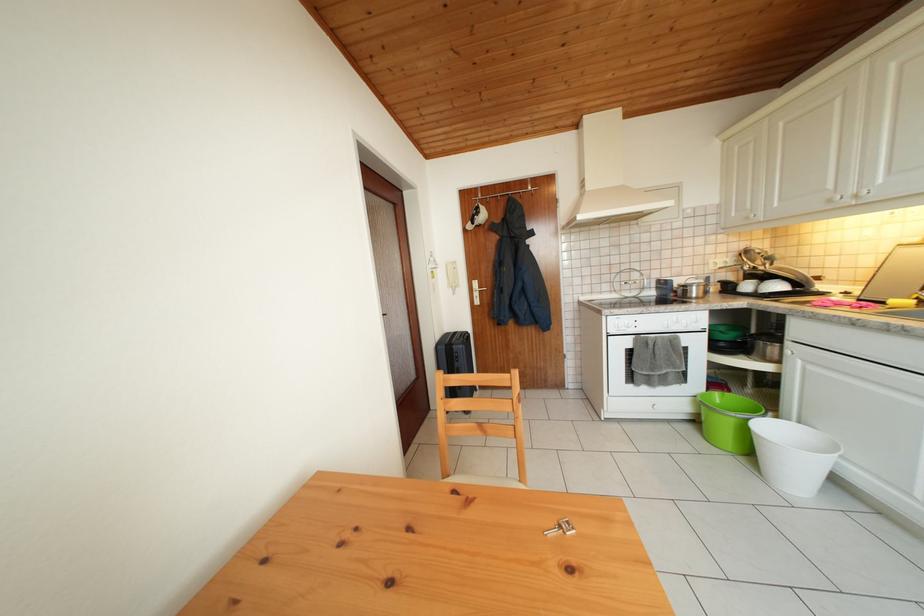
Which object does [727,419] point to?

This point indicates the green plastic bucket.